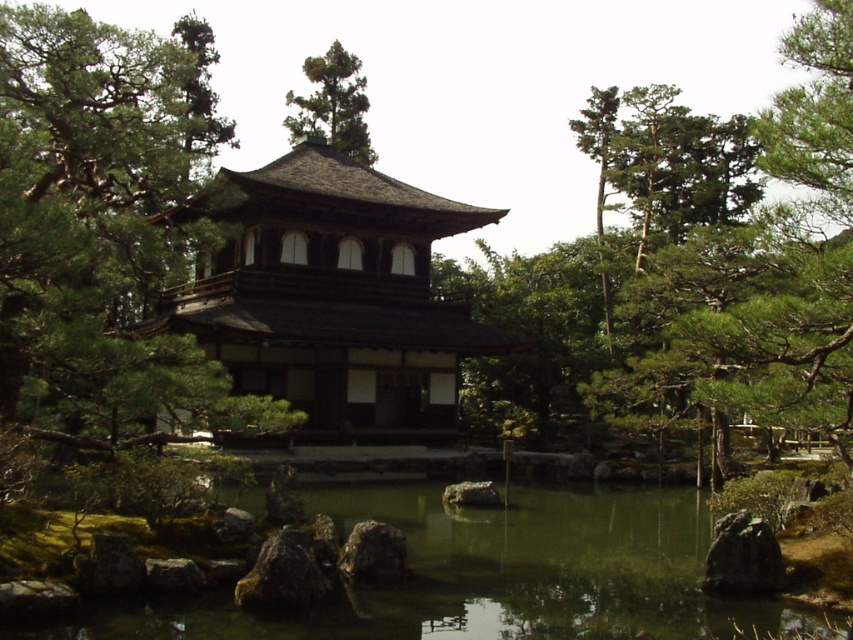
Question: Based on their relative distances, which object is nearer to the dark brown wooden temple at center?

Choices:
 (A) green reflective water at center
 (B) green matte tree at upper center

Answer: (A)

Question: Is green matte tree at left behind green textured tree at upper center?

Choices:
 (A) no
 (B) yes

Answer: (A)

Question: Which point is farther to the camera?

Choices:
 (A) (358, 554)
 (B) (83, 227)

Answer: (A)

Question: Among these points, which one is nearest to the camera?

Choices:
 (A) (343, 564)
 (B) (503, 572)
 (C) (315, 401)
 (D) (111, 196)

Answer: (A)

Question: In this image, where is green reflective water at center located relative to green textured tree at upper center?

Choices:
 (A) below
 (B) above

Answer: (A)

Question: Does dark brown wooden temple at center come in front of green reflective water at center?

Choices:
 (A) yes
 (B) no

Answer: (B)